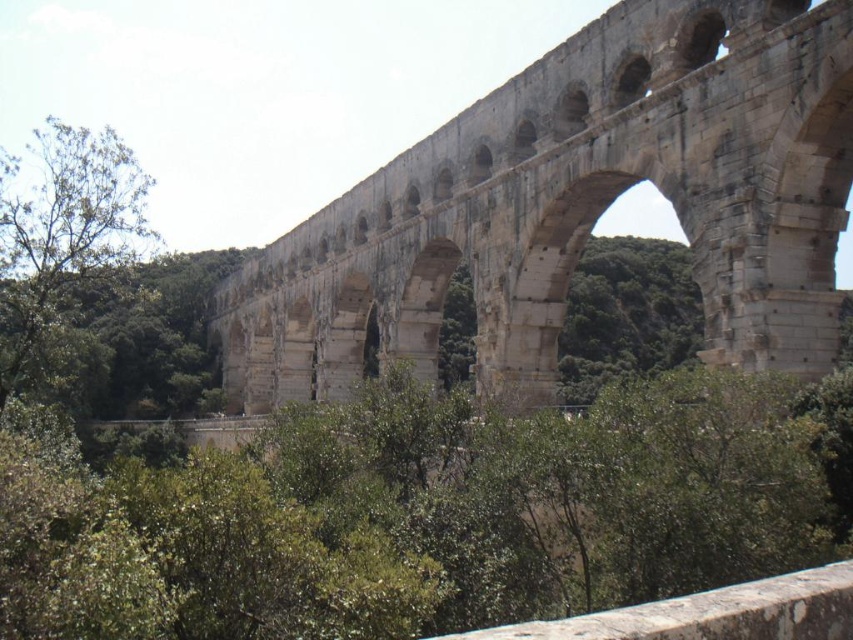
Which is more to the left, stone arch bridge at center or green leafy tree at left?

green leafy tree at left

From the picture: Can you confirm if stone arch bridge at center is taller than green leafy tree at left?

No.

Where is `stone arch bridge at center`? This screenshot has height=640, width=853. stone arch bridge at center is located at coordinates (578, 205).

Locate an element on the screen. Image resolution: width=853 pixels, height=640 pixels. stone arch bridge at center is located at coordinates (578, 205).